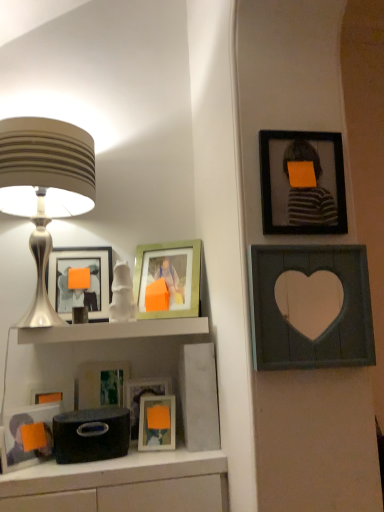
Question: From the image's perspective, is matte black picture frame at left, acting as the 3th picture frame starting from the left, on top of matte black box at center?

Choices:
 (A) no
 (B) yes

Answer: (B)

Question: From the image's perspective, is matte black picture frame at left, positioned as the fifth picture frame in right-to-left order, located beneath matte black box at center?

Choices:
 (A) no
 (B) yes

Answer: (A)

Question: Does matte black picture frame at left, positioned as the fifth picture frame in right-to-left order, appear on the left side of matte black box at center?

Choices:
 (A) yes
 (B) no

Answer: (A)

Question: Does matte black picture frame at left, positioned as the fifth picture frame in right-to-left order, come behind matte black box at center?

Choices:
 (A) no
 (B) yes

Answer: (B)

Question: Could matte black box at center be considered to be inside matte black picture frame at left, positioned as the fifth picture frame in right-to-left order?

Choices:
 (A) no
 (B) yes

Answer: (A)

Question: Is matte black picture frame at left, positioned as the fifth picture frame in right-to-left order, oriented towards matte black box at center?

Choices:
 (A) yes
 (B) no

Answer: (B)

Question: Is wooden heart-shaped frame at upper right, marked as the 7th picture frame in a left-to-right arrangement, at the right side of matte black picture frame at lower left, marked as the sixth picture frame in a right-to-left arrangement?

Choices:
 (A) yes
 (B) no

Answer: (A)

Question: Does wooden heart-shaped frame at upper right, arranged as the 1th picture frame when viewed from the right, come behind matte black picture frame at lower left, marked as the sixth picture frame in a right-to-left arrangement?

Choices:
 (A) no
 (B) yes

Answer: (A)

Question: Is wooden heart-shaped frame at upper right, arranged as the 1th picture frame when viewed from the right, surrounding matte black picture frame at lower left, the second picture frame from the left?

Choices:
 (A) yes
 (B) no

Answer: (B)

Question: From a real-world perspective, is wooden heart-shaped frame at upper right, marked as the 7th picture frame in a left-to-right arrangement, on matte black picture frame at lower left, the second picture frame from the left?

Choices:
 (A) yes
 (B) no

Answer: (A)

Question: Can you confirm if wooden heart-shaped frame at upper right, marked as the 7th picture frame in a left-to-right arrangement, is thinner than matte black picture frame at lower left, marked as the sixth picture frame in a right-to-left arrangement?

Choices:
 (A) no
 (B) yes

Answer: (B)

Question: Does wooden heart-shaped frame at upper right, marked as the 7th picture frame in a left-to-right arrangement, have a lesser height compared to matte black picture frame at lower left, marked as the sixth picture frame in a right-to-left arrangement?

Choices:
 (A) no
 (B) yes

Answer: (A)

Question: Is silver metallic lampshade at left positioned before matte glass picture frame at lower center, acting as the 4th picture frame starting from the right?

Choices:
 (A) yes
 (B) no

Answer: (A)